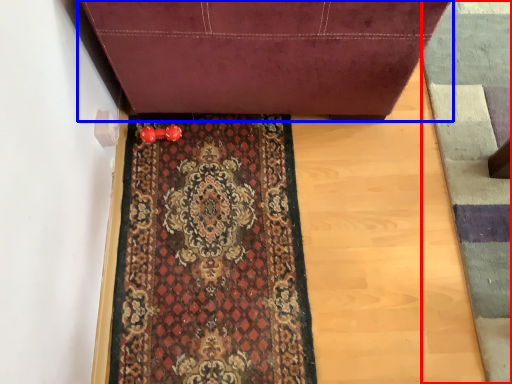
Question: Which object is closer to the camera taking this photo, doormat (highlighted by a red box) or furniture (highlighted by a blue box)?

Choices:
 (A) doormat
 (B) furniture

Answer: (B)